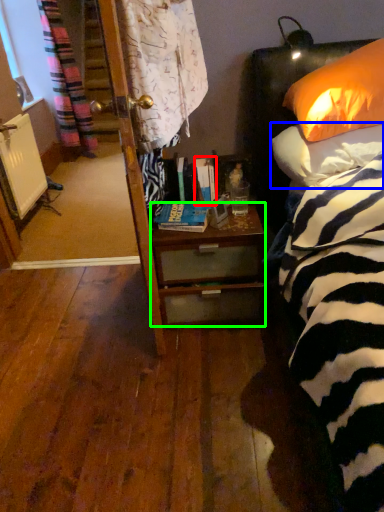
Question: Which object is the closest to the book (highlighted by a red box)? Choose among these: pillow (highlighted by a blue box) or desk (highlighted by a green box).

Choices:
 (A) pillow
 (B) desk

Answer: (B)